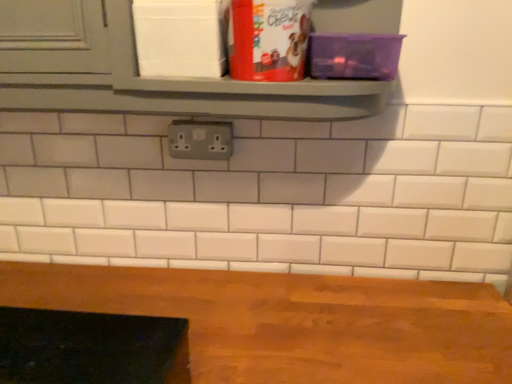
Question: From the image's perspective, is wooden table at bottom positioned above or below gray plastic outlet at center?

Choices:
 (A) below
 (B) above

Answer: (A)

Question: Visually, is wooden table at bottom positioned to the left or to the right of gray plastic outlet at center?

Choices:
 (A) right
 (B) left

Answer: (A)

Question: Relative to gray plastic outlet at center, is wooden table at bottom in front or behind?

Choices:
 (A) front
 (B) behind

Answer: (A)

Question: Considering the positions of gray plastic outlet at center and wooden table at bottom in the image, is gray plastic outlet at center bigger or smaller than wooden table at bottom?

Choices:
 (A) small
 (B) big

Answer: (A)

Question: Considering the relative positions of gray plastic outlet at center and wooden table at bottom in the image provided, is gray plastic outlet at center to the left or to the right of wooden table at bottom?

Choices:
 (A) right
 (B) left

Answer: (B)

Question: Does point (209, 150) appear closer or farther from the camera than point (449, 329)?

Choices:
 (A) farther
 (B) closer

Answer: (A)

Question: Is gray plastic outlet at center wider or thinner than wooden table at bottom?

Choices:
 (A) wide
 (B) thin

Answer: (B)